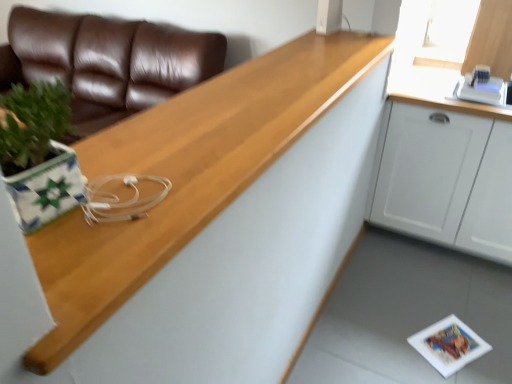
Question: Is brown leather couch at upper left surrounded by white matte cabinet at upper right?

Choices:
 (A) yes
 (B) no

Answer: (B)

Question: From a real-world perspective, is white matte cabinet at upper right positioned over brown leather couch at upper left based on gravity?

Choices:
 (A) no
 (B) yes

Answer: (A)

Question: Is white matte cabinet at upper right oriented away from brown leather couch at upper left?

Choices:
 (A) yes
 (B) no

Answer: (B)

Question: Does white matte cabinet at upper right have a greater height compared to brown leather couch at upper left?

Choices:
 (A) yes
 (B) no

Answer: (B)

Question: From the image's perspective, is white matte cabinet at upper right on top of brown leather couch at upper left?

Choices:
 (A) no
 (B) yes

Answer: (A)

Question: Is white matte cabinet at upper right positioned before brown leather couch at upper left?

Choices:
 (A) no
 (B) yes

Answer: (B)

Question: From a real-world perspective, is brown leather couch at upper left positioned over wooden at left based on gravity?

Choices:
 (A) no
 (B) yes

Answer: (A)

Question: From a real-world perspective, does brown leather couch at upper left sit lower than wooden at left?

Choices:
 (A) no
 (B) yes

Answer: (B)

Question: Can you confirm if brown leather couch at upper left is taller than wooden at left?

Choices:
 (A) yes
 (B) no

Answer: (A)

Question: Is the surface of brown leather couch at upper left in direct contact with wooden at left?

Choices:
 (A) yes
 (B) no

Answer: (B)

Question: Is brown leather couch at upper left oriented away from wooden at left?

Choices:
 (A) no
 (B) yes

Answer: (A)

Question: Can you confirm if brown leather couch at upper left is shorter than wooden at left?

Choices:
 (A) yes
 (B) no

Answer: (B)

Question: Is wooden at left positioned with its back to white matte cabinet at upper right?

Choices:
 (A) yes
 (B) no

Answer: (B)